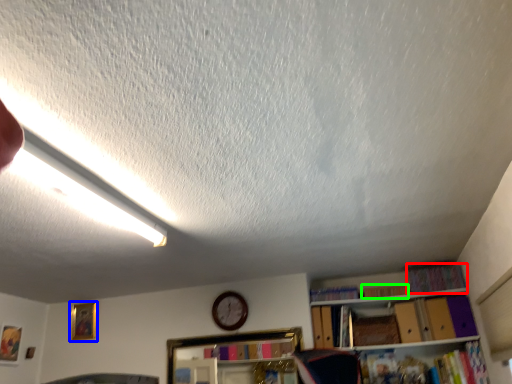
Question: Estimate the real-world distances between objects in this image. Which object is closer to book (highlighted by a red box), picture frame (highlighted by a blue box) or book (highlighted by a green box)?

Choices:
 (A) picture frame
 (B) book

Answer: (B)